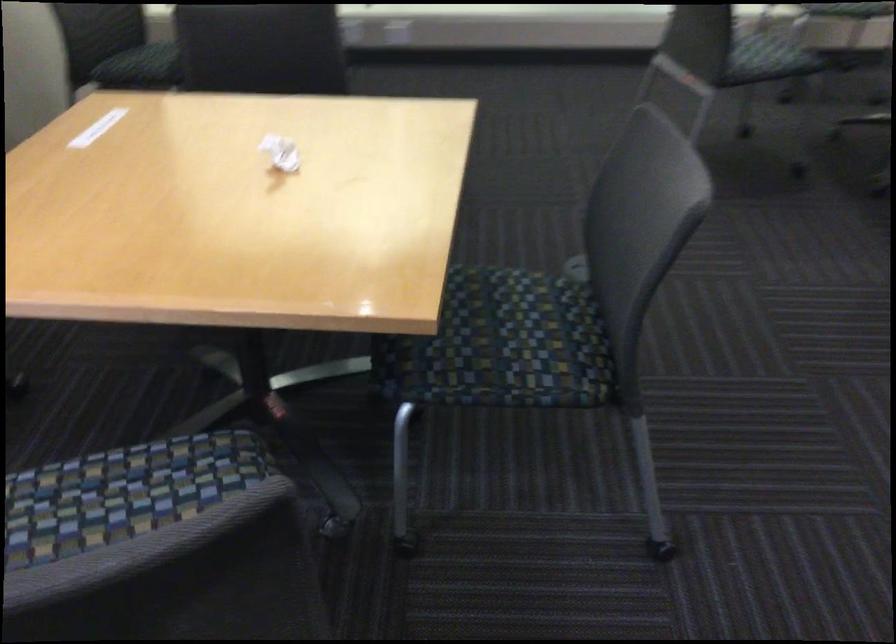
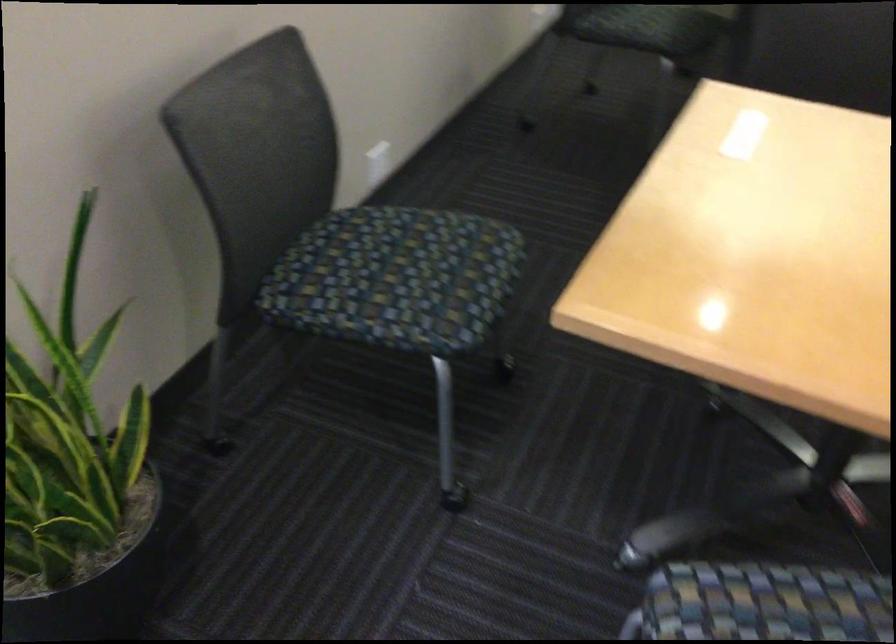
Question: The camera is either moving clockwise (left) or counter-clockwise (right) around the object. The first image is from the beginning of the video and the second image is from the end. Is the camera moving left or right when shooting the video?

Choices:
 (A) Left
 (B) Right

Answer: (B)